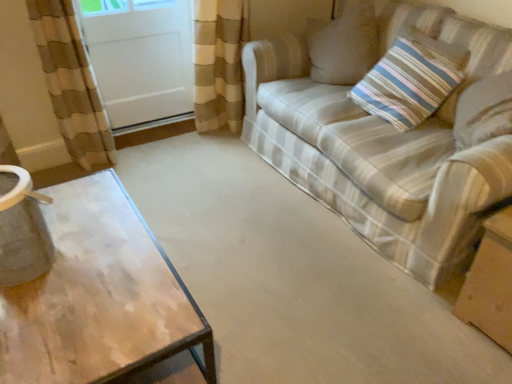
Question: Is white glossy screen door at upper left not close to striped fabric couch at right?

Choices:
 (A) no
 (B) yes

Answer: (B)

Question: Considering the relative sizes of white glossy screen door at upper left and striped fabric couch at right in the image provided, is white glossy screen door at upper left taller than striped fabric couch at right?

Choices:
 (A) yes
 (B) no

Answer: (B)

Question: Is the position of white glossy screen door at upper left more distant than that of striped fabric couch at right?

Choices:
 (A) yes
 (B) no

Answer: (A)

Question: Is white glossy screen door at upper left closer to camera compared to striped fabric couch at right?

Choices:
 (A) yes
 (B) no

Answer: (B)

Question: Is white glossy screen door at upper left oriented away from striped fabric couch at right?

Choices:
 (A) yes
 (B) no

Answer: (B)

Question: Is point (493, 319) positioned closer to the camera than point (298, 148)?

Choices:
 (A) farther
 (B) closer

Answer: (B)

Question: Choose the correct answer: Is brown cardboard box at lower right inside striped fabric couch at right or outside it?

Choices:
 (A) outside
 (B) inside

Answer: (A)

Question: In terms of width, does brown cardboard box at lower right look wider or thinner when compared to striped fabric couch at right?

Choices:
 (A) thin
 (B) wide

Answer: (A)

Question: Considering the relative positions of brown cardboard box at lower right and striped fabric couch at right in the image provided, is brown cardboard box at lower right to the left or to the right of striped fabric couch at right?

Choices:
 (A) left
 (B) right

Answer: (B)

Question: In terms of size, does striped fabric couch at right appear bigger or smaller than white glossy screen door at upper left?

Choices:
 (A) small
 (B) big

Answer: (B)

Question: Considering their positions, is striped fabric couch at right located in front of or behind white glossy screen door at upper left?

Choices:
 (A) front
 (B) behind

Answer: (A)

Question: Is point (480, 124) positioned closer to the camera than point (157, 46)?

Choices:
 (A) closer
 (B) farther

Answer: (A)

Question: Considering the positions of striped fabric couch at right and white glossy screen door at upper left in the image, is striped fabric couch at right taller or shorter than white glossy screen door at upper left?

Choices:
 (A) tall
 (B) short

Answer: (A)

Question: From a real-world perspective, is white glossy screen door at upper left physically located above or below striped fabric couch at right?

Choices:
 (A) below
 (B) above

Answer: (A)

Question: Looking at the image, does white glossy screen door at upper left seem bigger or smaller compared to striped fabric couch at right?

Choices:
 (A) big
 (B) small

Answer: (B)